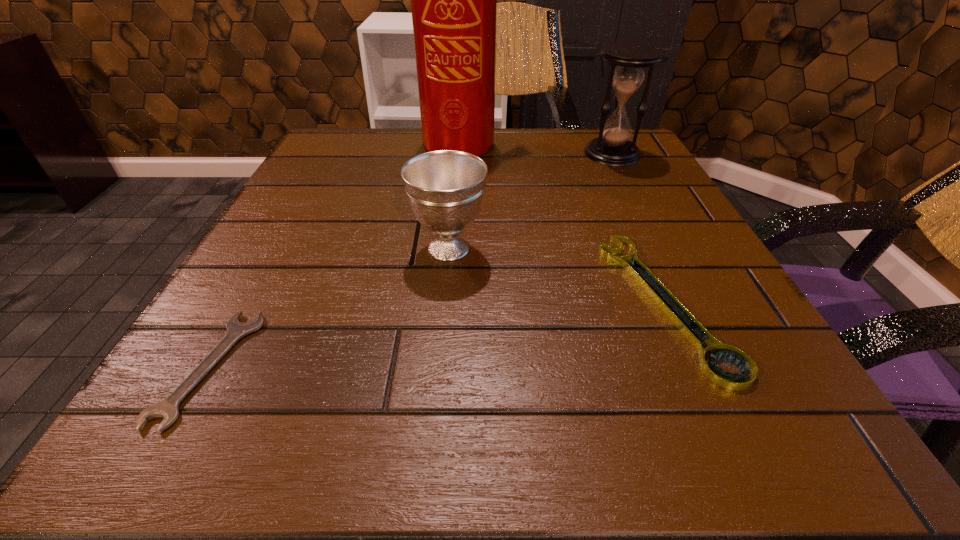
Locate an element on the screen. The image size is (960, 540). free space that is in between the hourglass and the taller wrench is located at coordinates (638, 228).

Find the location of `free space between the fourth shortest object and the chalice`. free space between the fourth shortest object and the chalice is located at coordinates (530, 201).

At what (x,y) coordinates should I click in order to perform the action: click on unoccupied position between the second shortest object and the second tallest object. Please return your answer as a coordinate pair (x, y). Looking at the image, I should click on (638, 228).

Identify the location of vacant area between the tallest object and the hourglass. The width and height of the screenshot is (960, 540). (538, 148).

The width and height of the screenshot is (960, 540). I want to click on free space between the second shortest object and the shorter wrench, so [x=437, y=335].

The height and width of the screenshot is (540, 960). Find the location of `vacant point located between the fire extinguisher and the hourglass`. vacant point located between the fire extinguisher and the hourglass is located at coordinates (538, 148).

Identify the location of free space that is in between the chalice and the fourth shortest object. (530, 201).

I want to click on object that stands as the closest to the shortest object, so click(445, 188).

At what (x,y) coordinates should I click in order to perform the action: click on the second closest object relative to the fourth shortest object. Please return your answer as a coordinate pair (x, y). The image size is (960, 540). Looking at the image, I should click on (696, 333).